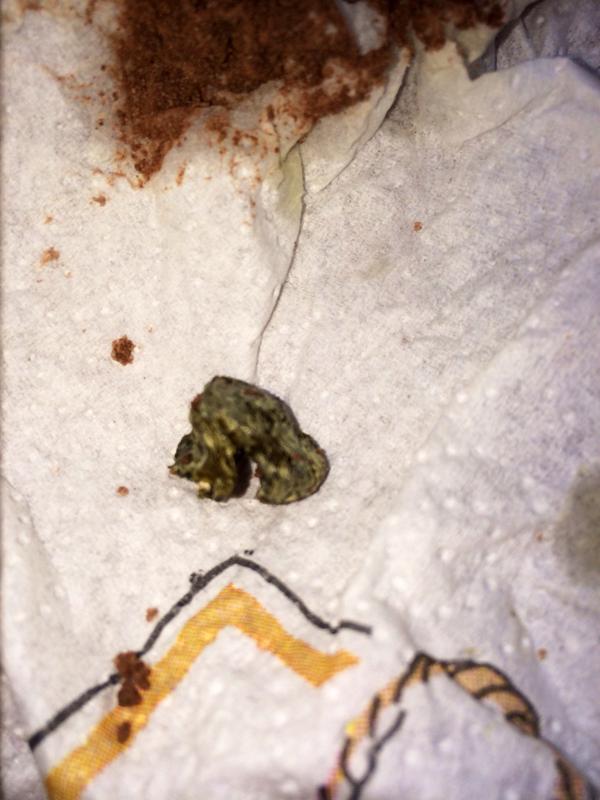
The width and height of the screenshot is (600, 800). Identify the location of towel. (330, 336).